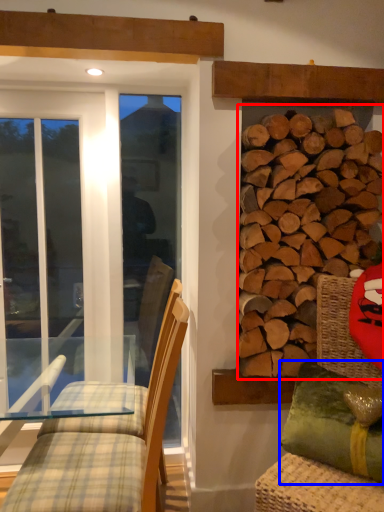
Question: Among these objects, which one is nearest to the camera, hardwood (highlighted by a red box) or pillow (highlighted by a blue box)?

Choices:
 (A) hardwood
 (B) pillow

Answer: (B)